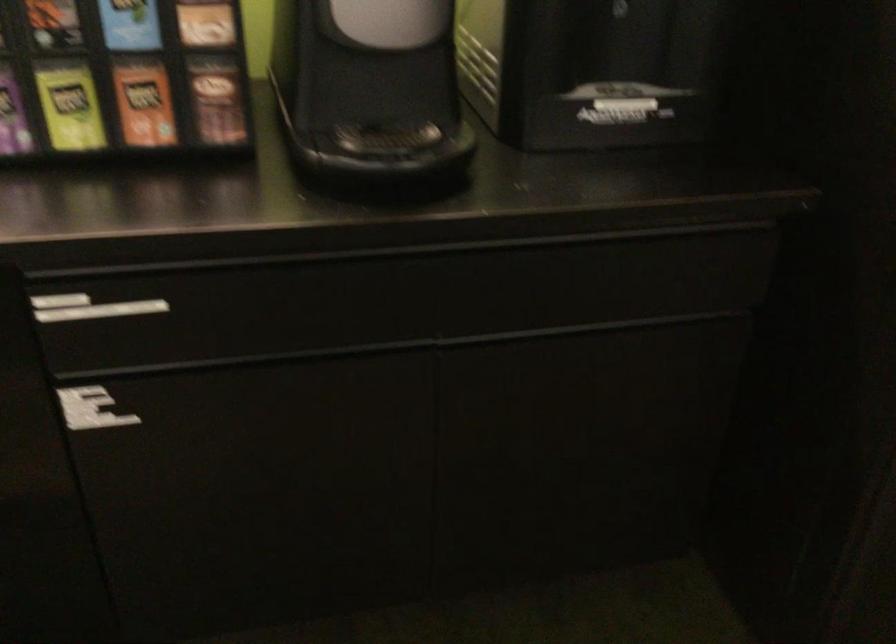
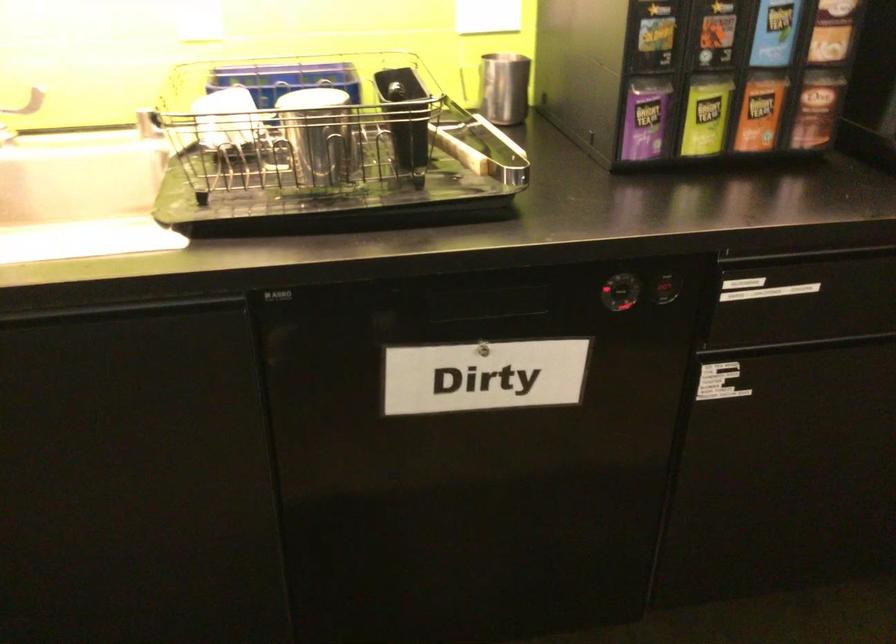
In the second image, find the point that corresponds to point 145,104 in the first image.

(760, 111)